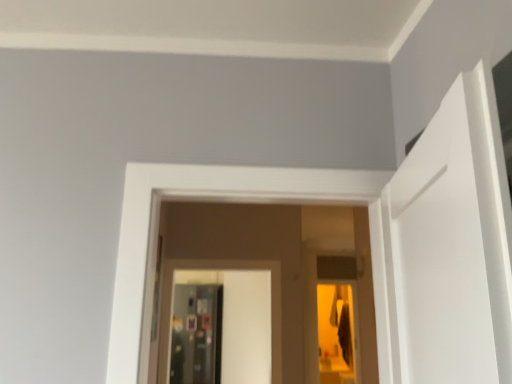
You are a GUI agent. You are given a task and a screenshot of the screen. Output one action in this format:
    pyautogui.click(x=<x>, y=<y>)
    Task: Click on the metallic silver screen door at center, the 2th screen door in the back-to-front sequence
    The image size is (512, 384).
    Given the screenshot: What is the action you would take?
    click(x=232, y=269)

Describe the element at coordinates (232, 269) in the screenshot. The width and height of the screenshot is (512, 384). I see `metallic silver screen door at center, the 2th screen door in the back-to-front sequence` at that location.

How much space does metallic silver screen door at center, marked as the first screen door in a front-to-back arrangement, occupy vertically?

The height of metallic silver screen door at center, marked as the first screen door in a front-to-back arrangement, is 37.97 inches.

This screenshot has height=384, width=512. Identify the location of metallic reflective screen door at center, arranged as the 1th screen door when viewed from the back. (196, 334).

This screenshot has height=384, width=512. What do you see at coordinates (196, 334) in the screenshot? I see `metallic reflective screen door at center, positioned as the second screen door in front-to-back order` at bounding box center [196, 334].

In order to click on metallic silver screen door at center, acting as the 2th screen door starting from the left in this screenshot , I will do `click(232, 269)`.

Does metallic silver screen door at center, marked as the first screen door in a front-to-back arrangement, appear on the right side of metallic reflective screen door at center, placed as the 2th screen door when sorted from right to left?

Yes.

Between metallic silver screen door at center, the 2th screen door in the back-to-front sequence, and metallic reflective screen door at center, positioned as the second screen door in front-to-back order, which one is positioned behind?

metallic reflective screen door at center, positioned as the second screen door in front-to-back order, is behind.

Considering the positions of point (268, 269) and point (183, 289), is point (268, 269) closer or farther from the camera than point (183, 289)?

Point (268, 269) is closer to the camera than point (183, 289).

From the image's perspective, which one is positioned lower, metallic silver screen door at center, marked as the first screen door in a front-to-back arrangement, or metallic reflective screen door at center, which is the 1th screen door in left-to-right order?

metallic reflective screen door at center, which is the 1th screen door in left-to-right order.

Looking at this image, from a real-world perspective, does metallic silver screen door at center, arranged as the first screen door when viewed from the right, sit lower than metallic reflective screen door at center, positioned as the second screen door in front-to-back order?

Incorrect, from a real-world perspective, metallic silver screen door at center, arranged as the first screen door when viewed from the right, is higher than metallic reflective screen door at center, positioned as the second screen door in front-to-back order.

Which of these two, metallic silver screen door at center, marked as the first screen door in a front-to-back arrangement, or metallic reflective screen door at center, positioned as the second screen door in front-to-back order, is thinner?

Thinner between the two is metallic silver screen door at center, marked as the first screen door in a front-to-back arrangement.

Considering the relative sizes of metallic silver screen door at center, marked as the first screen door in a front-to-back arrangement, and metallic reflective screen door at center, placed as the 2th screen door when sorted from right to left, in the image provided, is metallic silver screen door at center, marked as the first screen door in a front-to-back arrangement, taller than metallic reflective screen door at center, placed as the 2th screen door when sorted from right to left,?

No, metallic silver screen door at center, marked as the first screen door in a front-to-back arrangement, is not taller than metallic reflective screen door at center, placed as the 2th screen door when sorted from right to left.

Considering the sizes of objects metallic silver screen door at center, acting as the 2th screen door starting from the left, and metallic reflective screen door at center, arranged as the 1th screen door when viewed from the back, in the image provided, who is smaller, metallic silver screen door at center, acting as the 2th screen door starting from the left, or metallic reflective screen door at center, arranged as the 1th screen door when viewed from the back,?

Smaller between the two is metallic silver screen door at center, acting as the 2th screen door starting from the left.

Is metallic silver screen door at center, marked as the first screen door in a front-to-back arrangement, inside or outside of metallic reflective screen door at center, arranged as the 1th screen door when viewed from the back?

metallic silver screen door at center, marked as the first screen door in a front-to-back arrangement, is not enclosed by metallic reflective screen door at center, arranged as the 1th screen door when viewed from the back.

Is metallic silver screen door at center, arranged as the first screen door when viewed from the right, in contact with metallic reflective screen door at center, positioned as the second screen door in front-to-back order?

metallic silver screen door at center, arranged as the first screen door when viewed from the right, is not next to metallic reflective screen door at center, positioned as the second screen door in front-to-back order, and they're not touching.

Is metallic silver screen door at center, acting as the 2th screen door starting from the left, turned away from metallic reflective screen door at center, which is the 1th screen door in left-to-right order?

Absolutely, metallic silver screen door at center, acting as the 2th screen door starting from the left, is directed away from metallic reflective screen door at center, which is the 1th screen door in left-to-right order.

Can you tell me how much metallic silver screen door at center, the 2th screen door in the back-to-front sequence, and metallic reflective screen door at center, placed as the 2th screen door when sorted from right to left, differ in facing direction?

metallic silver screen door at center, the 2th screen door in the back-to-front sequence, and metallic reflective screen door at center, placed as the 2th screen door when sorted from right to left, are facing 4.43 degrees away from each other.

Find the location of a particular element. Image resolution: width=512 pixels, height=384 pixels. screen door above the metallic reflective screen door at center, arranged as the 1th screen door when viewed from the back (from a real-world perspective) is located at coordinates (232, 269).

Can you confirm if metallic reflective screen door at center, placed as the 2th screen door when sorted from right to left, is positioned to the left of metallic silver screen door at center, arranged as the first screen door when viewed from the right?

Yes, metallic reflective screen door at center, placed as the 2th screen door when sorted from right to left, is to the left of metallic silver screen door at center, arranged as the first screen door when viewed from the right.

Is metallic reflective screen door at center, positioned as the second screen door in front-to-back order, closer to the viewer compared to metallic silver screen door at center, acting as the 2th screen door starting from the left?

No, the depth of metallic reflective screen door at center, positioned as the second screen door in front-to-back order, is greater than that of metallic silver screen door at center, acting as the 2th screen door starting from the left.

Does point (190, 374) come behind point (198, 267)?

That is True.

From the image's perspective, is metallic reflective screen door at center, arranged as the 1th screen door when viewed from the back, beneath metallic silver screen door at center, marked as the first screen door in a front-to-back arrangement?

Yes, from the image's perspective, metallic reflective screen door at center, arranged as the 1th screen door when viewed from the back, is below metallic silver screen door at center, marked as the first screen door in a front-to-back arrangement.

From a real-world perspective, which is physically above, metallic reflective screen door at center, which is the 1th screen door in left-to-right order, or metallic silver screen door at center, marked as the first screen door in a front-to-back arrangement?

In real-world perspective, metallic silver screen door at center, marked as the first screen door in a front-to-back arrangement, is above.

Can you confirm if metallic reflective screen door at center, arranged as the 1th screen door when viewed from the back, is thinner than metallic silver screen door at center, acting as the 2th screen door starting from the left?

Incorrect, the width of metallic reflective screen door at center, arranged as the 1th screen door when viewed from the back, is not less than that of metallic silver screen door at center, acting as the 2th screen door starting from the left.

Is metallic reflective screen door at center, which is the 1th screen door in left-to-right order, taller than metallic silver screen door at center, arranged as the first screen door when viewed from the right?

Indeed, metallic reflective screen door at center, which is the 1th screen door in left-to-right order, has a greater height compared to metallic silver screen door at center, arranged as the first screen door when viewed from the right.

Based on the photo, is metallic reflective screen door at center, positioned as the second screen door in front-to-back order, bigger or smaller than metallic silver screen door at center, arranged as the first screen door when viewed from the right?

metallic reflective screen door at center, positioned as the second screen door in front-to-back order, is bigger than metallic silver screen door at center, arranged as the first screen door when viewed from the right.

Would you say metallic reflective screen door at center, arranged as the 1th screen door when viewed from the back, contains metallic silver screen door at center, arranged as the first screen door when viewed from the right?

No, metallic silver screen door at center, arranged as the first screen door when viewed from the right, is not a part of metallic reflective screen door at center, arranged as the 1th screen door when viewed from the back.

Is there a large distance between metallic reflective screen door at center, placed as the 2th screen door when sorted from right to left, and metallic silver screen door at center, the 2th screen door in the back-to-front sequence?

Indeed, metallic reflective screen door at center, placed as the 2th screen door when sorted from right to left, is not near metallic silver screen door at center, the 2th screen door in the back-to-front sequence.

From the picture: Could you tell me if metallic reflective screen door at center, arranged as the 1th screen door when viewed from the back, is facing metallic silver screen door at center, the 2th screen door in the back-to-front sequence?

Yes, metallic reflective screen door at center, arranged as the 1th screen door when viewed from the back, is facing metallic silver screen door at center, the 2th screen door in the back-to-front sequence.

How far apart are metallic reflective screen door at center, which is the 1th screen door in left-to-right order, and metallic silver screen door at center, acting as the 2th screen door starting from the left?

The distance of metallic reflective screen door at center, which is the 1th screen door in left-to-right order, from metallic silver screen door at center, acting as the 2th screen door starting from the left, is 2.68 meters.

You are a GUI agent. You are given a task and a screenshot of the screen. Output one action in this format:
    pyautogui.click(x=<x>, y=<y>)
    Task: Click on the screen door below the metallic silver screen door at center, the 2th screen door in the back-to-front sequence (from the image's perspective)
    This screenshot has width=512, height=384.
    Given the screenshot: What is the action you would take?
    pyautogui.click(x=196, y=334)

Image resolution: width=512 pixels, height=384 pixels. Identify the location of screen door lying behind the metallic silver screen door at center, marked as the first screen door in a front-to-back arrangement. (196, 334).

Locate an element on the screen. screen door above the metallic reflective screen door at center, positioned as the second screen door in front-to-back order (from a real-world perspective) is located at coordinates (232, 269).